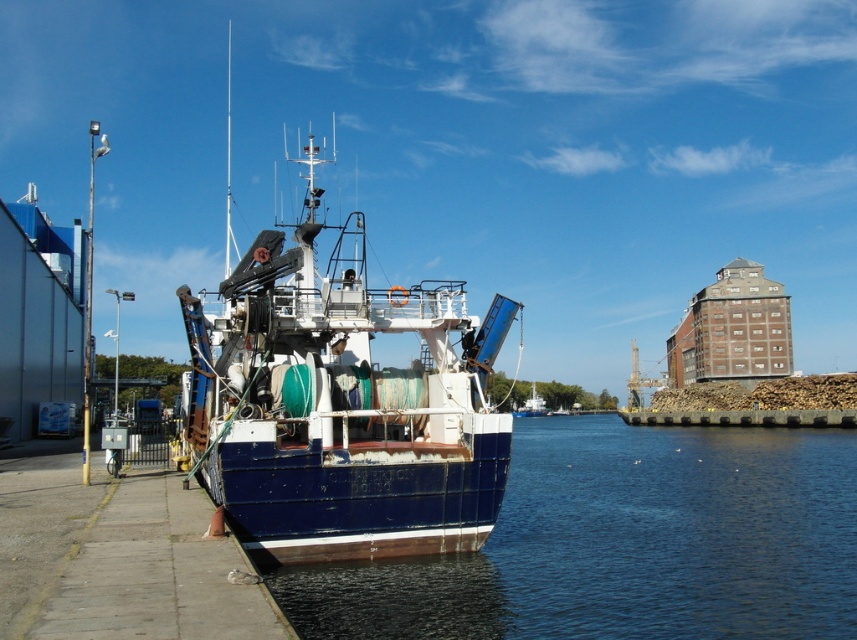
You are standing on the fishing vessel and want to jump into the water. The coordinates of the point where you want to jump are point (624,545). Is that point located on the blue water at lower left?

Yes, the point (624,545) is on the blue water at lower left, so jumping there would land you in the water.

You are standing on the pier and want to get to the blue painted wooden boat at center. Which direction should you move to reach it from the blue water at lower left?

The blue water at lower left is in front of the blue painted wooden boat at center, so to reach the boat, you should move towards the direction away from the blue water at lower left.